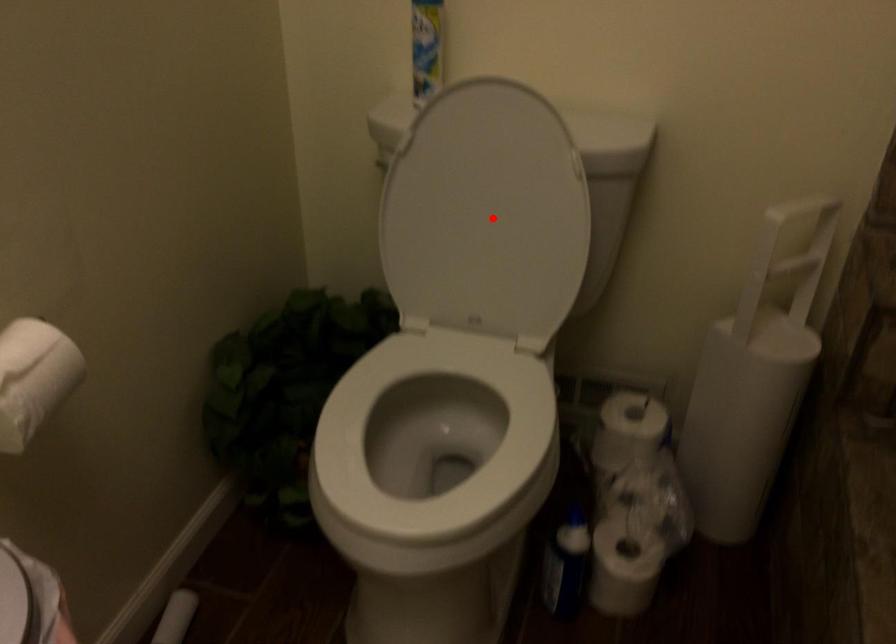
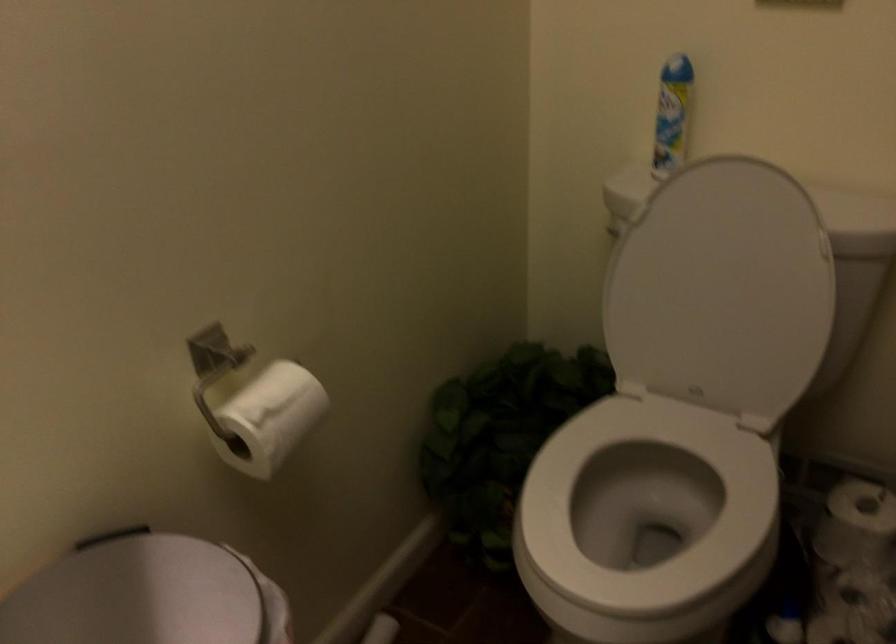
Locate, in the second image, the point that corresponds to the highlighted location in the first image.

(721, 289)